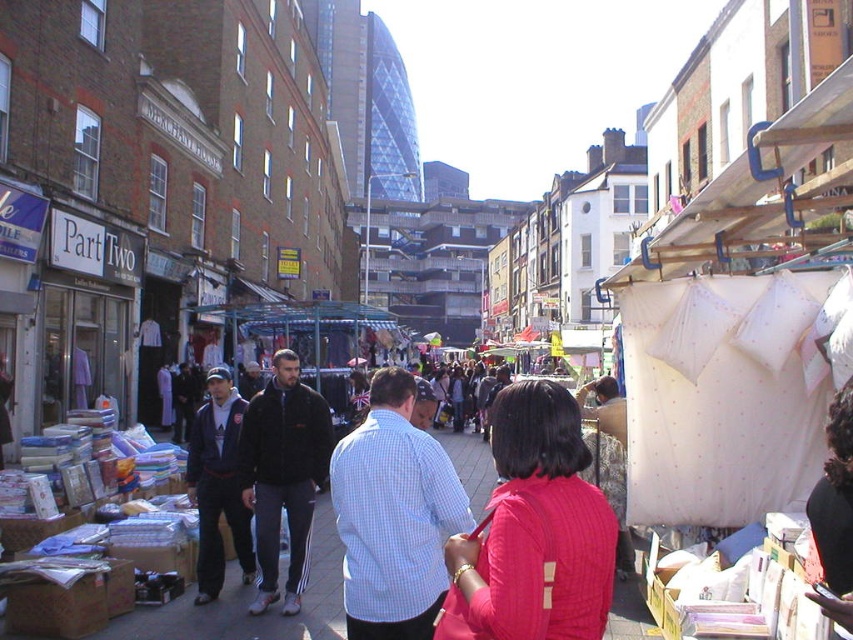
You are a vendor at the market and have a limited space on your display table. You need to place both the ribbed pink sweater at center and the light blue checkered shirt at center side by side. Which item should you place first to ensure they both fit?

The ribbed pink sweater at center is thinner than the light blue checkered shirt at center, so you should place the light blue checkered shirt at center first to accommodate its width before adding the thinner sweater.

You are a delivery person who needs to place a ribbed pink sweater at center on a table that is 2 meters long. Can the sweater be placed on the table without folding it?

The ribbed pink sweater at center is 20.16 meters in length, which is much longer than the 2 meter table. Therefore, the sweater cannot be placed on the table without folding it.

You are a customer at the market and want to buy a sweater and a shirt. You see the ribbed pink sweater at center and the light blue checkered shirt at center. Which item is smaller in size?

The ribbed pink sweater at center is smaller than the light blue checkered shirt at center.